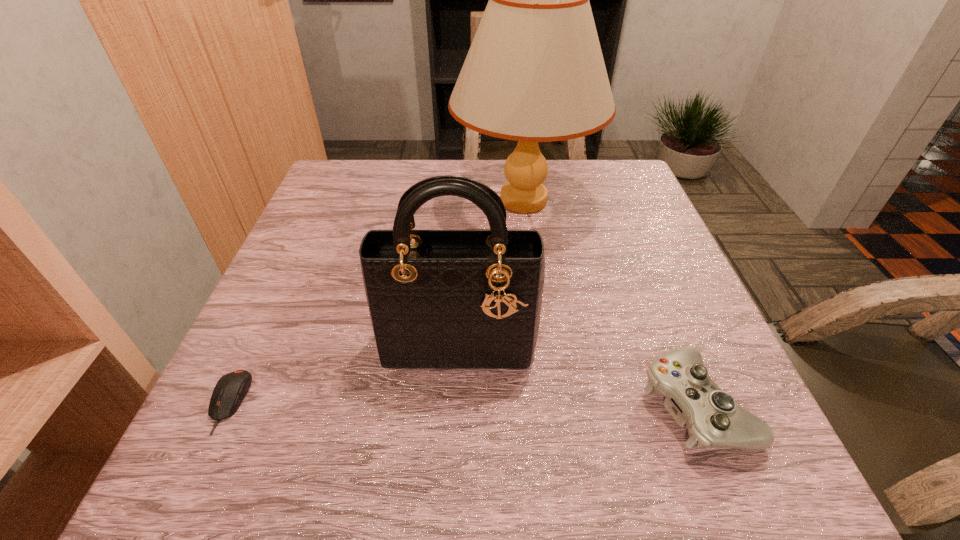
Locate an element on the screen. free space at the right edge is located at coordinates (668, 278).

Locate an element on the screen. Image resolution: width=960 pixels, height=540 pixels. free space at the far left corner of the desktop is located at coordinates (320, 199).

In the image, there is a desktop. At what (x,y) coordinates should I click in order to perform the action: click on vacant space at the near left corner. Please return your answer as a coordinate pair (x, y). Looking at the image, I should click on (193, 497).

The image size is (960, 540). Identify the location of free spot at the far right corner of the desktop. (627, 190).

Locate an element on the screen. free spot between the third tallest object and the leftmost object is located at coordinates (463, 403).

Locate an element on the screen. The image size is (960, 540). free space that is in between the tallest object and the third tallest object is located at coordinates (610, 302).

The width and height of the screenshot is (960, 540). Identify the location of unoccupied position between the third tallest object and the computer mouse. (463, 403).

At what (x,y) coordinates should I click in order to perform the action: click on blank region between the second tallest object and the second shortest object. Please return your answer as a coordinate pair (x, y). Image resolution: width=960 pixels, height=540 pixels. Looking at the image, I should click on (577, 374).

Where is `vacant space in between the leftmost object and the second shortest object`? The height and width of the screenshot is (540, 960). vacant space in between the leftmost object and the second shortest object is located at coordinates (463, 403).

Image resolution: width=960 pixels, height=540 pixels. Identify the location of empty location between the third shortest object and the third tallest object. (577, 374).